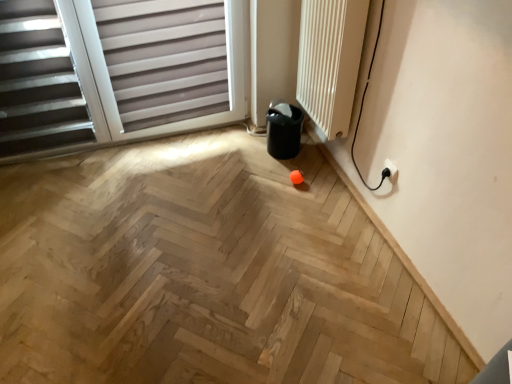
The image size is (512, 384). What do you see at coordinates (205, 273) in the screenshot?
I see `natural wood floor at center` at bounding box center [205, 273].

Image resolution: width=512 pixels, height=384 pixels. What do you see at coordinates (117, 71) in the screenshot? I see `matte gray blinds at upper left` at bounding box center [117, 71].

This screenshot has width=512, height=384. Find the location of `white plastic electric outlet at lower right`. white plastic electric outlet at lower right is located at coordinates (390, 171).

Find the location of `natural wood floor at center`. natural wood floor at center is located at coordinates pos(205,273).

From a real-world perspective, which is physically above, matte gray blinds at upper left or white textured radiator at upper right?

In real-world perspective, white textured radiator at upper right is above.

In the scene shown: Which point is more forward, (2, 161) or (314, 18)?

Point (314, 18)

Based on the photo, is the surface of matte gray blinds at upper left in direct contact with white textured radiator at upper right?

No, matte gray blinds at upper left is not touching white textured radiator at upper right.

How much distance is there between matte gray blinds at upper left and white textured radiator at upper right?

A distance of 28.00 inches exists between matte gray blinds at upper left and white textured radiator at upper right.

Considering the relative sizes of white plastic electric outlet at lower right and matte gray blinds at upper left in the image provided, is white plastic electric outlet at lower right bigger than matte gray blinds at upper left?

Incorrect, white plastic electric outlet at lower right is not larger than matte gray blinds at upper left.

Which point is more distant from viewer, (392,176) or (105,94)?

Point (105,94)

Is matte gray blinds at upper left completely or partially inside white plastic electric outlet at lower right?

Definitely not — matte gray blinds at upper left is not inside white plastic electric outlet at lower right.

From the image's perspective, is white plastic electric outlet at lower right below matte gray blinds at upper left?

Yes, from the image's perspective, white plastic electric outlet at lower right is below matte gray blinds at upper left.

Considering the sizes of objects natural wood floor at center and matte gray blinds at upper left in the image provided, who is wider, natural wood floor at center or matte gray blinds at upper left?

natural wood floor at center.

From the image's perspective, does natural wood floor at center appear higher than matte gray blinds at upper left?

No, from the image's perspective, natural wood floor at center is not on top of matte gray blinds at upper left.

Would you say natural wood floor at center is inside or outside matte gray blinds at upper left?

natural wood floor at center is outside matte gray blinds at upper left.

Which is less distant, (72, 323) or (129, 137)?

The point (72, 323) is closer.

Considering their positions, is white textured radiator at upper right located in front of or behind natural wood floor at center?

white textured radiator at upper right is behind natural wood floor at center.

Could you tell me if white textured radiator at upper right is turned towards natural wood floor at center?

No.

Does white textured radiator at upper right touch natural wood floor at center?

No, white textured radiator at upper right is not in contact with natural wood floor at center.

From the image's perspective, is white textured radiator at upper right beneath natural wood floor at center?

No, from the image's perspective, white textured radiator at upper right is not below natural wood floor at center.

Considering the relative sizes of matte gray blinds at upper left and white plastic electric outlet at lower right in the image provided, is matte gray blinds at upper left taller than white plastic electric outlet at lower right?

Yes, matte gray blinds at upper left is taller than white plastic electric outlet at lower right.

Consider the image. Which is more distant, (x=218, y=54) or (x=387, y=161)?

The point (x=218, y=54) is behind.

From the image's perspective, who appears lower, matte gray blinds at upper left or white plastic electric outlet at lower right?

white plastic electric outlet at lower right.

Is matte gray blinds at upper left far from white plastic electric outlet at lower right?

matte gray blinds at upper left is far away from white plastic electric outlet at lower right.

From the image's perspective, relative to matte gray blinds at upper left, is white textured radiator at upper right above or below?

white textured radiator at upper right is situated higher than matte gray blinds at upper left in the image.

Considering the relative sizes of white textured radiator at upper right and matte gray blinds at upper left in the image provided, is white textured radiator at upper right bigger than matte gray blinds at upper left?

Incorrect, white textured radiator at upper right is not larger than matte gray blinds at upper left.

In terms of width, does white textured radiator at upper right look wider or thinner when compared to matte gray blinds at upper left?

white textured radiator at upper right is wider than matte gray blinds at upper left.

In the image, there is a matte gray blinds at upper left. At what (x,y) coordinates should I click in order to perform the action: click on radiator above it (from the image's perspective). Please return your answer as a coordinate pair (x, y). Image resolution: width=512 pixels, height=384 pixels. Looking at the image, I should click on (330, 61).

Visually, is natural wood floor at center positioned to the left or to the right of white plastic electric outlet at lower right?

In the image, natural wood floor at center appears on the left side of white plastic electric outlet at lower right.

Is natural wood floor at center positioned with its back to white plastic electric outlet at lower right?

That's not correct — natural wood floor at center is not looking away from white plastic electric outlet at lower right.

Between natural wood floor at center and white plastic electric outlet at lower right, which one is positioned in front?

Positioned in front is natural wood floor at center.

Identify the location of window that is on the left side of white textured radiator at upper right. (117, 71).

The width and height of the screenshot is (512, 384). There is a white plastic electric outlet at lower right. What are the coordinates of `window above it (from a real-world perspective)` in the screenshot? It's located at (117, 71).

When comparing their distances from white plastic electric outlet at lower right, does natural wood floor at center or matte gray blinds at upper left seem closer?

natural wood floor at center is positioned closer to the anchor white plastic electric outlet at lower right.

When comparing their distances from white textured radiator at upper right, does natural wood floor at center or white plastic electric outlet at lower right seem further?

natural wood floor at center is further to white textured radiator at upper right.

Looking at the image, which one is located closer to white textured radiator at upper right, natural wood floor at center or matte gray blinds at upper left?

Based on the image, matte gray blinds at upper left appears to be nearer to white textured radiator at upper right.

Considering their positions, is natural wood floor at center positioned closer to matte gray blinds at upper left than white textured radiator at upper right?

natural wood floor at center is positioned closer to the anchor matte gray blinds at upper left.

From the image, which object appears to be nearer to white plastic electric outlet at lower right, natural wood floor at center or white textured radiator at upper right?

Among the two, white textured radiator at upper right is located nearer to white plastic electric outlet at lower right.

When comparing their distances from natural wood floor at center, does white textured radiator at upper right or matte gray blinds at upper left seem further?

white textured radiator at upper right lies further to natural wood floor at center than the other object.

Estimate the real-world distances between objects in this image. Which object is further from matte gray blinds at upper left, white textured radiator at upper right or natural wood floor at center?

white textured radiator at upper right.

Looking at the image, which one is located closer to white plastic electric outlet at lower right, matte gray blinds at upper left or natural wood floor at center?

natural wood floor at center is closer to white plastic electric outlet at lower right.

You are a GUI agent. You are given a task and a screenshot of the screen. Output one action in this format:
    pyautogui.click(x=<x>, y=<y>)
    Task: Click on the electric outlet that lies between white textured radiator at upper right and natural wood floor at center from top to bottom
    The height and width of the screenshot is (384, 512).
    Given the screenshot: What is the action you would take?
    pyautogui.click(x=390, y=171)

Where is `plywood situated between matte gray blinds at upper left and white textured radiator at upper right from left to right`? plywood situated between matte gray blinds at upper left and white textured radiator at upper right from left to right is located at coordinates (205, 273).

This screenshot has height=384, width=512. I want to click on radiator situated between matte gray blinds at upper left and white plastic electric outlet at lower right from left to right, so click(x=330, y=61).

Identify the location of plywood located between matte gray blinds at upper left and white plastic electric outlet at lower right in the left-right direction. (205, 273).